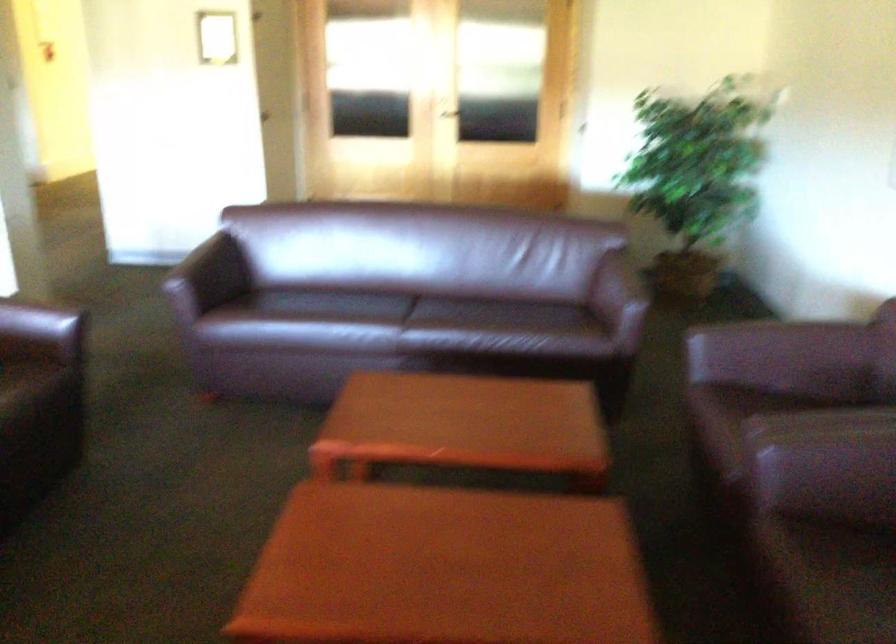
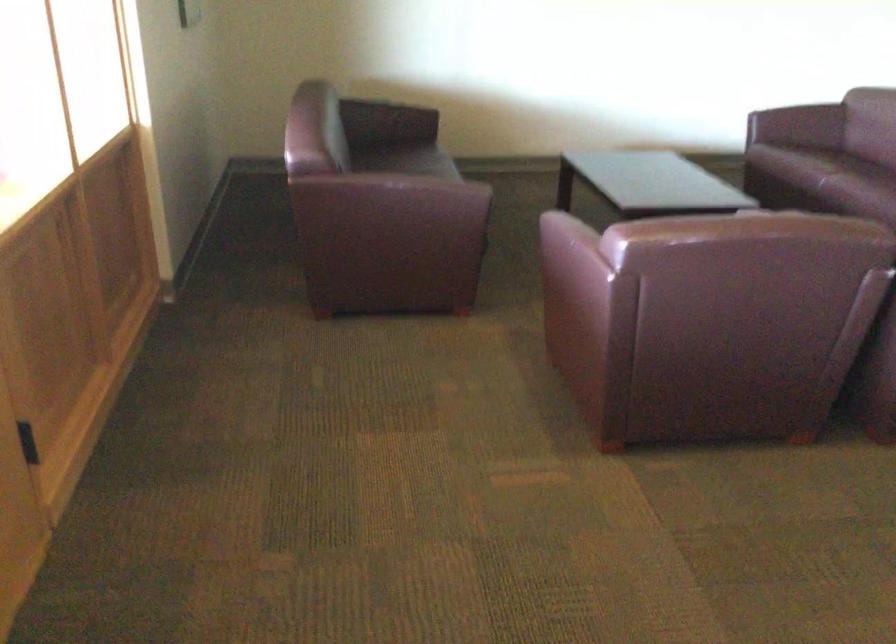
Looking at this image, the images are taken continuously from a first-person perspective. In which direction is your viewpoint rotating?

The camera's rotation is toward right-down.